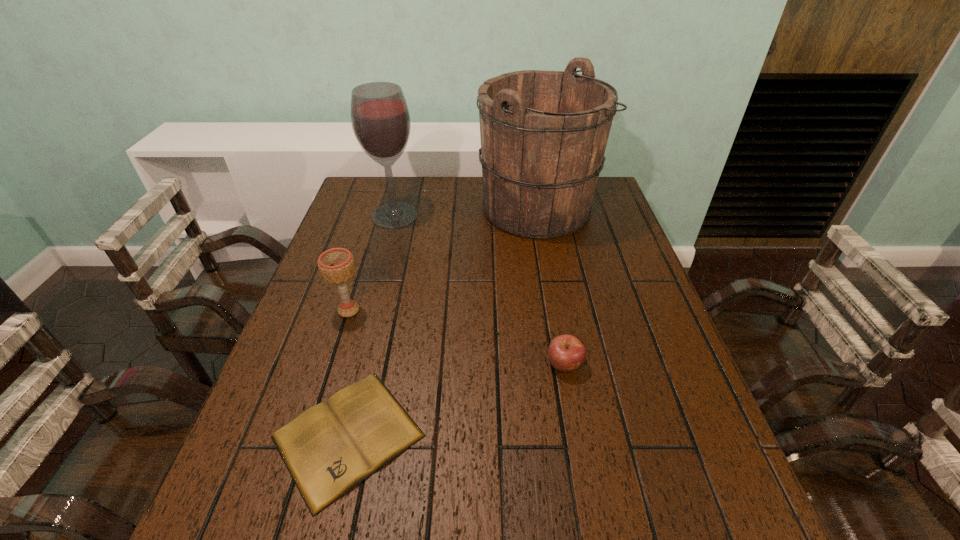
Identify the location of vacant region located on the back of the book. The image size is (960, 540). (371, 346).

At what (x,y) coordinates should I click in order to perform the action: click on bucket located in the far edge section of the desktop. Please return your answer as a coordinate pair (x, y). The width and height of the screenshot is (960, 540). Looking at the image, I should click on (x=543, y=134).

This screenshot has width=960, height=540. Identify the location of alcohol located in the far edge section of the desktop. (380, 119).

Where is `object that is at the near edge`? This screenshot has height=540, width=960. object that is at the near edge is located at coordinates (331, 447).

Find the location of a particular element. The width and height of the screenshot is (960, 540). alcohol that is positioned at the left edge is located at coordinates (380, 119).

What are the coordinates of `chalice at the left edge` in the screenshot? It's located at (336, 265).

You are a GUI agent. You are given a task and a screenshot of the screen. Output one action in this format:
    pyautogui.click(x=<x>, y=<y>)
    Task: Click on the book that is at the left edge
    This screenshot has width=960, height=540.
    Given the screenshot: What is the action you would take?
    pyautogui.click(x=331, y=447)

Locate an element on the screen. This screenshot has height=540, width=960. object at the right edge is located at coordinates (543, 134).

Find the location of a particular element. The height and width of the screenshot is (540, 960). object that is at the far left corner is located at coordinates (380, 119).

Locate an element on the screen. The width and height of the screenshot is (960, 540). object present at the near left corner is located at coordinates (331, 447).